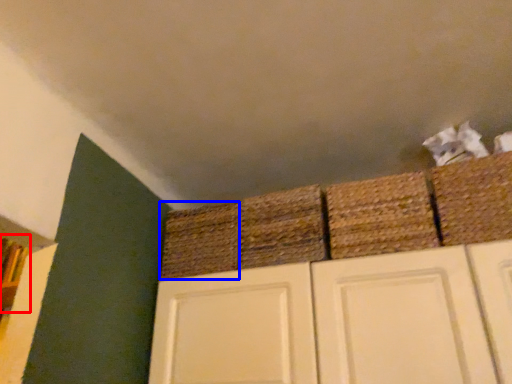
Question: Which object is further to the camera taking this photo, shelf (highlighted by a red box) or basket (highlighted by a blue box)?

Choices:
 (A) shelf
 (B) basket

Answer: (A)